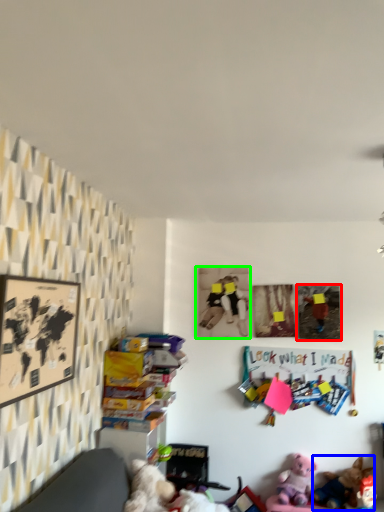
Question: Which is nearer to the picture frame (highlighted by a red box)? toy (highlighted by a blue box) or picture frame (highlighted by a green box).

Choices:
 (A) toy
 (B) picture frame

Answer: (B)